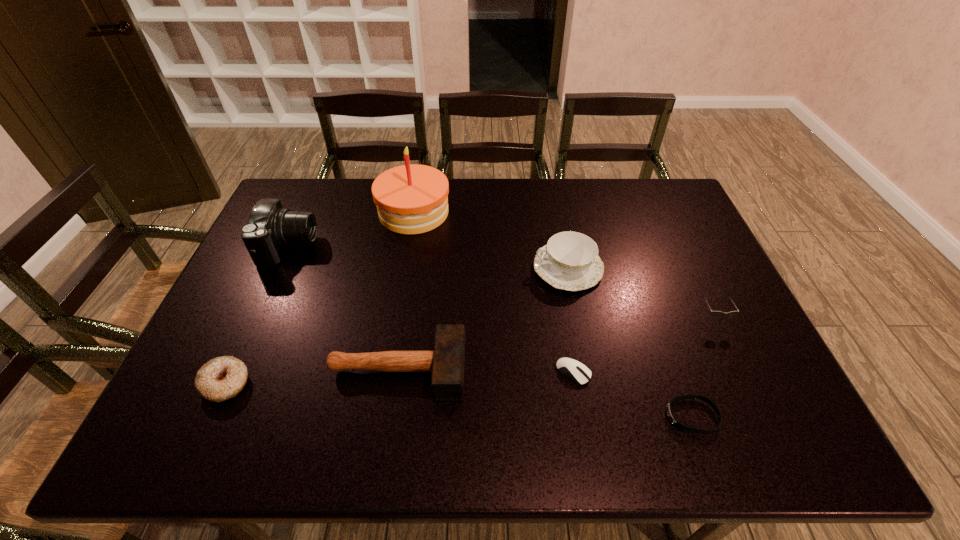
This screenshot has height=540, width=960. I want to click on vacant space positioned 0.190m on the display of the seventh object from left to right, so click(x=581, y=416).

At what (x,y) coordinates should I click in order to perform the action: click on free location located 0.130m on the display of the seventh object from left to right. Please return your answer as a coordinate pair (x, y). The height and width of the screenshot is (540, 960). Looking at the image, I should click on (608, 416).

I want to click on object that is at the far edge, so click(x=411, y=199).

Where is `object at the near edge`? This screenshot has height=540, width=960. object at the near edge is located at coordinates [670, 414].

Identify the location of camera at the left edge. pos(269,227).

Identify the location of doughnut that is positioned at the left edge. This screenshot has height=540, width=960. (222, 378).

Identify the location of object at the right edge. This screenshot has height=540, width=960. (714, 313).

Find the location of a particular element. Image resolution: width=960 pixels, height=540 pixels. free spot at the far edge of the desktop is located at coordinates (537, 207).

Image resolution: width=960 pixels, height=540 pixels. Identify the location of vacant region at the near edge of the desktop. (455, 441).

Image resolution: width=960 pixels, height=540 pixels. Find the location of `free space at the left edge`. free space at the left edge is located at coordinates (191, 367).